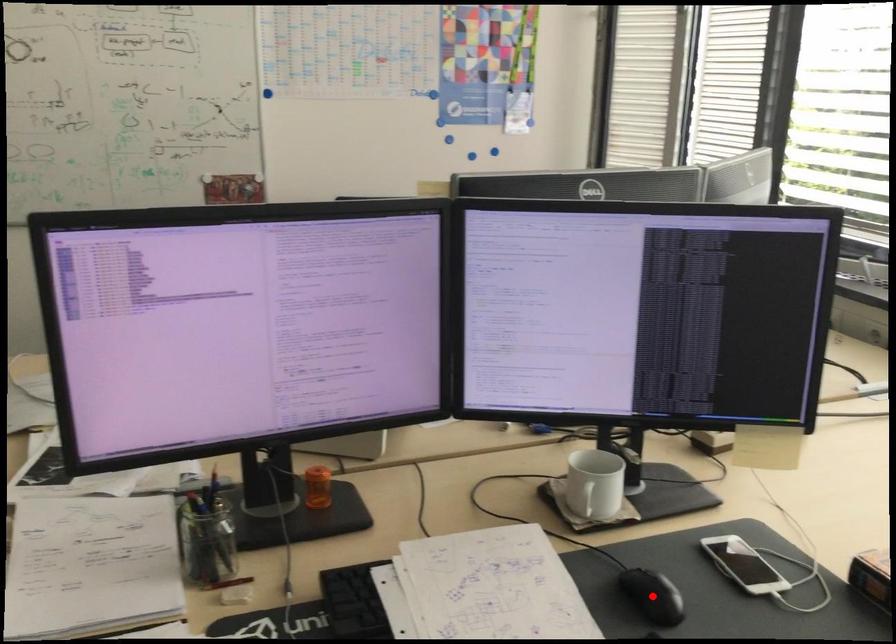
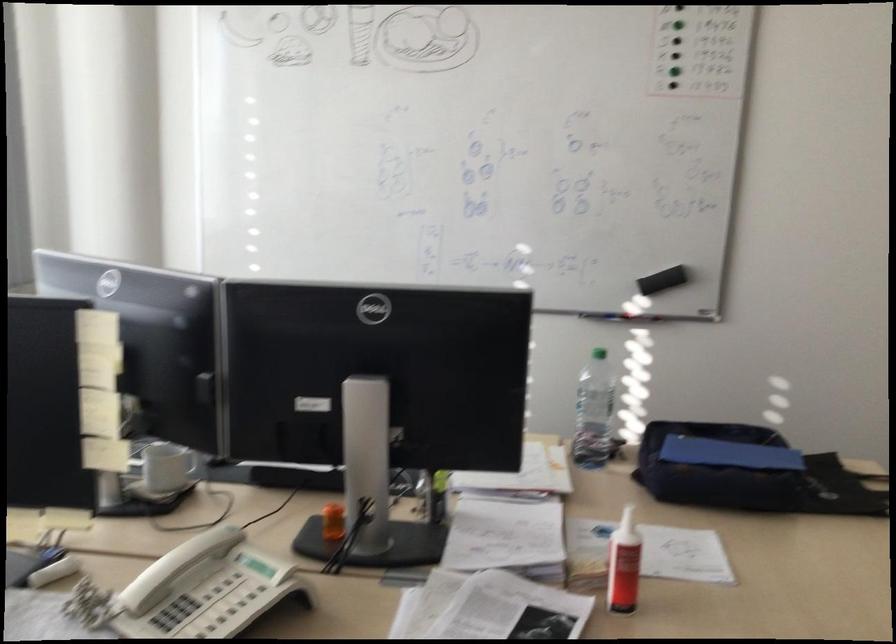
Question: I am providing you with two images of the same scene from different viewpoints. A red point is marked on the first image. Can you still see the location of the red point in image 2?

Choices:
 (A) Yes
 (B) No

Answer: (B)